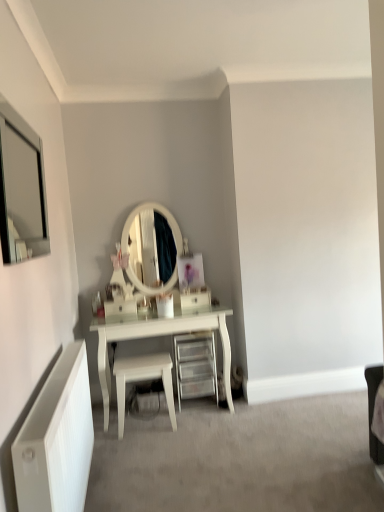
Question: Is white glossy stool at center further to the viewer compared to white matte radiator at lower left?

Choices:
 (A) no
 (B) yes

Answer: (B)

Question: Is white glossy stool at center completely or partially outside of white matte radiator at lower left?

Choices:
 (A) yes
 (B) no

Answer: (A)

Question: Is the surface of white glossy stool at center in direct contact with white matte radiator at lower left?

Choices:
 (A) yes
 (B) no

Answer: (B)

Question: Is white glossy stool at center thinner than white matte radiator at lower left?

Choices:
 (A) yes
 (B) no

Answer: (B)

Question: From a real-world perspective, does white glossy stool at center sit lower than white matte radiator at lower left?

Choices:
 (A) no
 (B) yes

Answer: (B)

Question: Does white glossy stool at center have a smaller size compared to white matte radiator at lower left?

Choices:
 (A) yes
 (B) no

Answer: (A)

Question: Is white matte radiator at lower left at the left side of matte silver mirror at upper left?

Choices:
 (A) no
 (B) yes

Answer: (A)

Question: Can you confirm if white matte radiator at lower left is bigger than matte silver mirror at upper left?

Choices:
 (A) yes
 (B) no

Answer: (A)

Question: Is white matte radiator at lower left aimed at matte silver mirror at upper left?

Choices:
 (A) no
 (B) yes

Answer: (A)

Question: From the image's perspective, is white matte radiator at lower left on top of matte silver mirror at upper left?

Choices:
 (A) no
 (B) yes

Answer: (A)

Question: From the image's perspective, is white matte radiator at lower left below matte silver mirror at upper left?

Choices:
 (A) no
 (B) yes

Answer: (B)

Question: Is white matte radiator at lower left completely or partially outside of matte silver mirror at upper left?

Choices:
 (A) yes
 (B) no

Answer: (A)

Question: Is white glossy drawer at center facing away from white glossy stool at center?

Choices:
 (A) no
 (B) yes

Answer: (A)